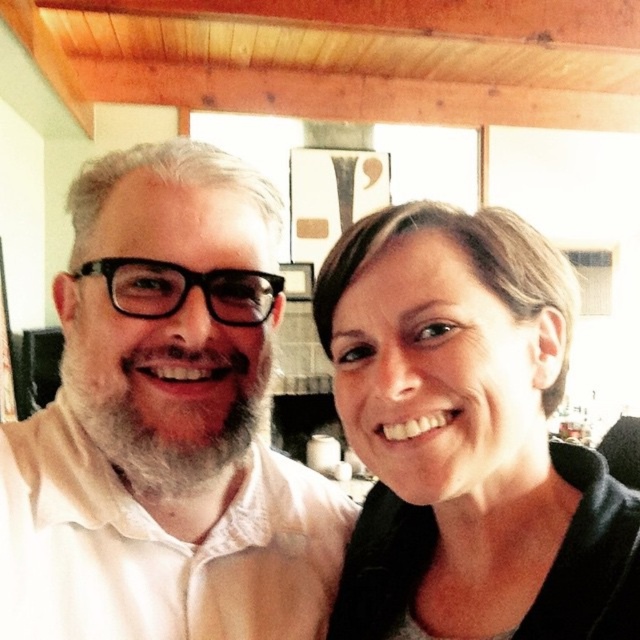
Which is more to the left, matte black hair at upper right or white matte beard at left?

Positioned to the left is white matte beard at left.

This screenshot has width=640, height=640. Describe the element at coordinates (467, 436) in the screenshot. I see `matte black hair at upper right` at that location.

You are a GUI agent. You are given a task and a screenshot of the screen. Output one action in this format:
    pyautogui.click(x=<x>, y=<y>)
    Task: Click on the matte black hair at upper right
    The height and width of the screenshot is (640, 640).
    Given the screenshot: What is the action you would take?
    pyautogui.click(x=467, y=436)